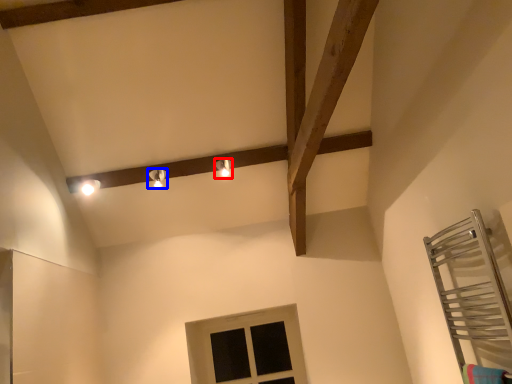
Question: Which object appears closest to the camera in this image, light fixture (highlighted by a red box) or light fixture (highlighted by a blue box)?

Choices:
 (A) light fixture
 (B) light fixture

Answer: (B)